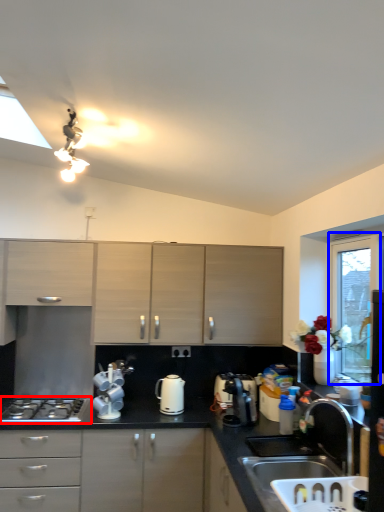
Question: Which object is further to the camera taking this photo, gas stove (highlighted by a red box) or window screen (highlighted by a blue box)?

Choices:
 (A) gas stove
 (B) window screen

Answer: (A)